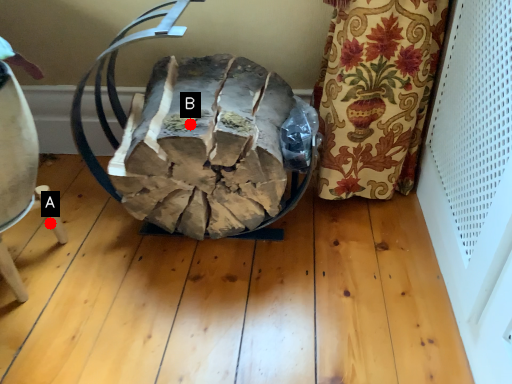
Question: Two points are circled on the image, labeled by A and B beside each circle. Which point is farther to the camera?

Choices:
 (A) A is further
 (B) B is further

Answer: (A)